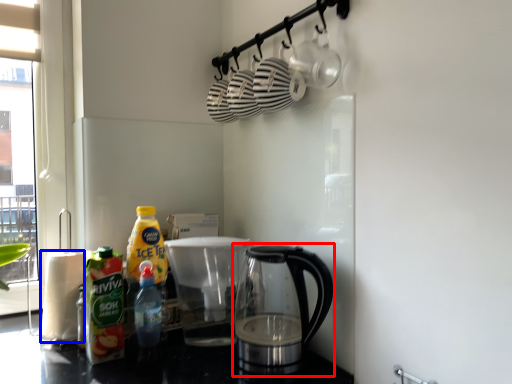
Question: Among these objects, which one is farthest to the camera, kettle (highlighted by a red box) or paper towel (highlighted by a blue box)?

Choices:
 (A) kettle
 (B) paper towel

Answer: (B)